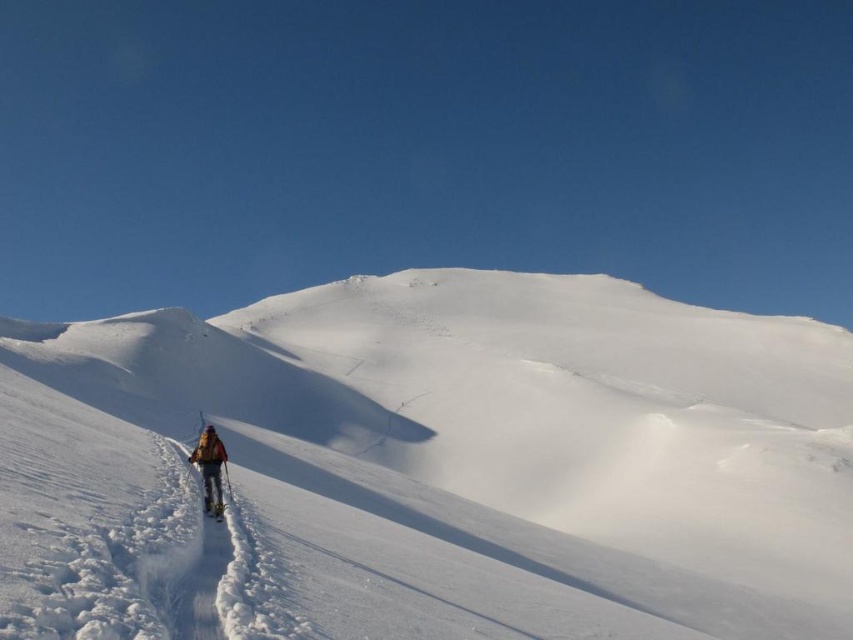
Question: Where is yellow fabric jacket at center located in relation to white matte ski at lower center in the image?

Choices:
 (A) above
 (B) below

Answer: (A)

Question: Which of these objects is positioned farthest from the yellow fabric jacket at center?

Choices:
 (A) white powdery snow at center
 (B) white matte ski at lower center

Answer: (A)

Question: Can you confirm if white powdery snow at center is positioned to the right of white matte ski at lower center?

Choices:
 (A) no
 (B) yes

Answer: (B)

Question: Estimate the real-world distances between objects in this image. Which object is farther from the white matte ski at lower center?

Choices:
 (A) white powdery snow at center
 (B) yellow fabric jacket at center

Answer: (A)

Question: Which point is closer to the camera taking this photo?

Choices:
 (A) (744, 348)
 (B) (212, 442)
 (C) (218, 502)

Answer: (C)

Question: Is white powdery snow at center smaller than yellow fabric jacket at center?

Choices:
 (A) yes
 (B) no

Answer: (B)